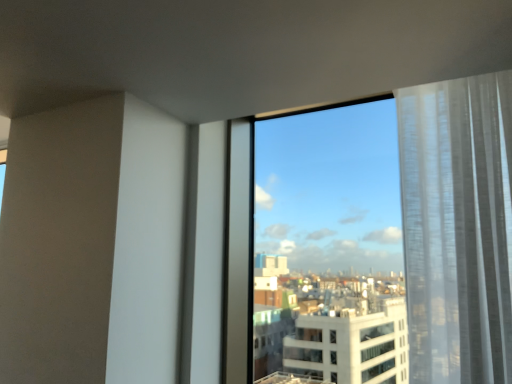
Question: Should I look upward or downward to see transparent glass window at center?

Choices:
 (A) down
 (B) up

Answer: (A)

Question: Can you confirm if white sheer curtain at right is wider than transparent glass window at center?

Choices:
 (A) yes
 (B) no

Answer: (A)

Question: Is transparent glass window at center located within white sheer curtain at right?

Choices:
 (A) no
 (B) yes

Answer: (A)

Question: From the image's perspective, is white sheer curtain at right on top of transparent glass window at center?

Choices:
 (A) yes
 (B) no

Answer: (A)

Question: Is white sheer curtain at right located outside transparent glass window at center?

Choices:
 (A) yes
 (B) no

Answer: (A)

Question: Is white sheer curtain at right further to the viewer compared to transparent glass window at center?

Choices:
 (A) no
 (B) yes

Answer: (A)

Question: From a real-world perspective, does white sheer curtain at right stand above transparent glass window at center?

Choices:
 (A) yes
 (B) no

Answer: (A)

Question: From the image's perspective, would you say transparent glass window at center is positioned over white sheer curtain at right?

Choices:
 (A) no
 (B) yes

Answer: (A)

Question: Would you say transparent glass window at center contains white sheer curtain at right?

Choices:
 (A) yes
 (B) no

Answer: (B)

Question: Is transparent glass window at center further to camera compared to white sheer curtain at right?

Choices:
 (A) no
 (B) yes

Answer: (B)

Question: Is transparent glass window at center oriented towards white sheer curtain at right?

Choices:
 (A) yes
 (B) no

Answer: (B)

Question: Considering the relative sizes of transparent glass window at center and white sheer curtain at right in the image provided, is transparent glass window at center thinner than white sheer curtain at right?

Choices:
 (A) yes
 (B) no

Answer: (A)

Question: Is transparent glass window at center oriented away from white sheer curtain at right?

Choices:
 (A) yes
 (B) no

Answer: (B)

Question: Would you say white sheer curtain at right is inside or outside transparent glass window at center?

Choices:
 (A) outside
 (B) inside

Answer: (A)